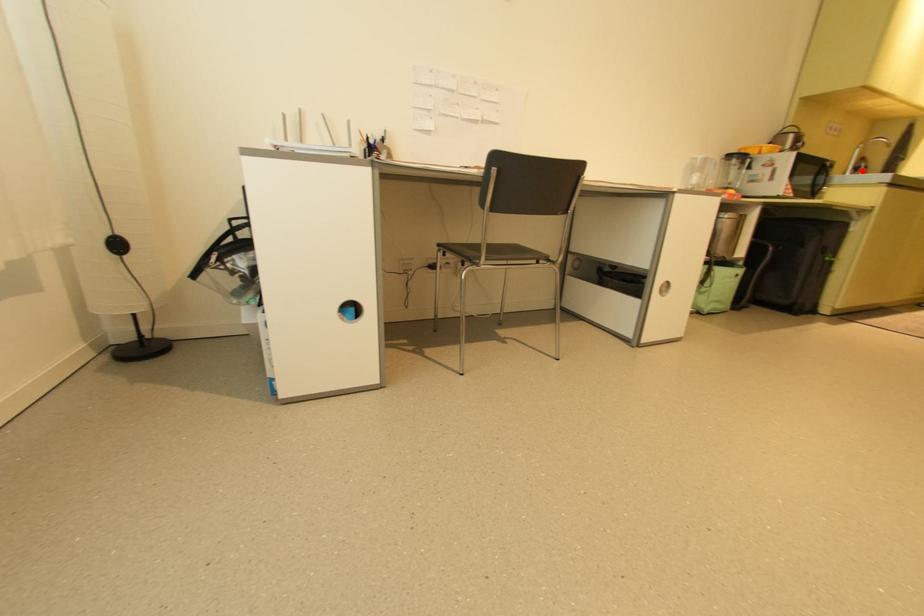
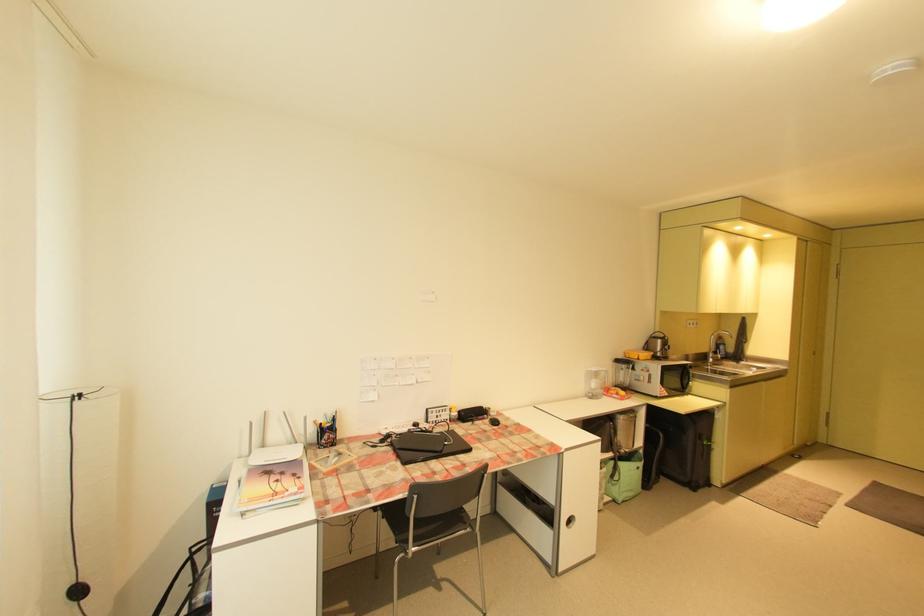
Where in the second image is the point corresponding to the highlighted location from the first image?

(722, 353)